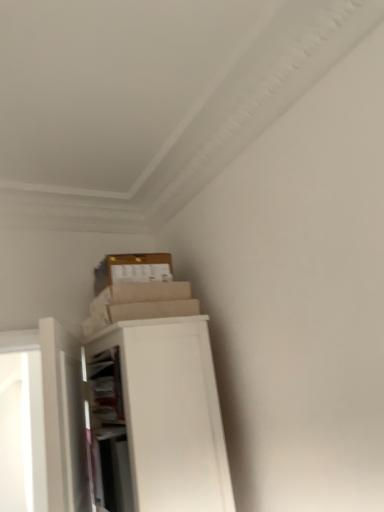
Question: From a real-world perspective, is white matte door at left on white matte/file cabinet at upper left?

Choices:
 (A) yes
 (B) no

Answer: (A)

Question: Considering the relative sizes of white matte door at left and white matte/file cabinet at upper left in the image provided, is white matte door at left smaller than white matte/file cabinet at upper left?

Choices:
 (A) no
 (B) yes

Answer: (B)

Question: Are white matte door at left and white matte/file cabinet at upper left far apart?

Choices:
 (A) no
 (B) yes

Answer: (A)

Question: From the image's perspective, is white matte door at left on top of white matte/file cabinet at upper left?

Choices:
 (A) yes
 (B) no

Answer: (A)

Question: Would you say white matte door at left contains white matte/file cabinet at upper left?

Choices:
 (A) no
 (B) yes

Answer: (A)

Question: Does white matte door at left lie in front of white matte/file cabinet at upper left?

Choices:
 (A) yes
 (B) no

Answer: (A)

Question: Does white matte/file cabinet at upper left appear on the right side of white matte door at left?

Choices:
 (A) no
 (B) yes

Answer: (B)

Question: Is white matte/file cabinet at upper left shorter than white matte door at left?

Choices:
 (A) no
 (B) yes

Answer: (A)

Question: From a real-world perspective, is white matte/file cabinet at upper left beneath white matte door at left?

Choices:
 (A) no
 (B) yes

Answer: (B)

Question: Considering the relative sizes of white matte/file cabinet at upper left and white matte door at left in the image provided, is white matte/file cabinet at upper left wider than white matte door at left?

Choices:
 (A) yes
 (B) no

Answer: (A)

Question: Is white matte/file cabinet at upper left taller than white matte door at left?

Choices:
 (A) yes
 (B) no

Answer: (A)

Question: From a real-world perspective, is white matte/file cabinet at upper left positioned over white matte door at left based on gravity?

Choices:
 (A) yes
 (B) no

Answer: (B)

Question: Is white matte/file cabinet at upper left taller or shorter than white matte door at left?

Choices:
 (A) tall
 (B) short

Answer: (A)